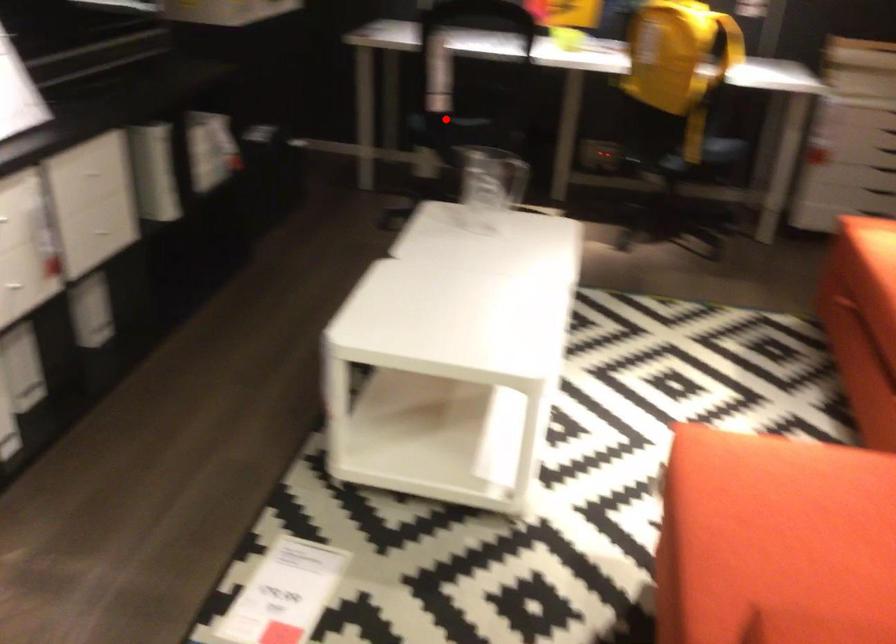
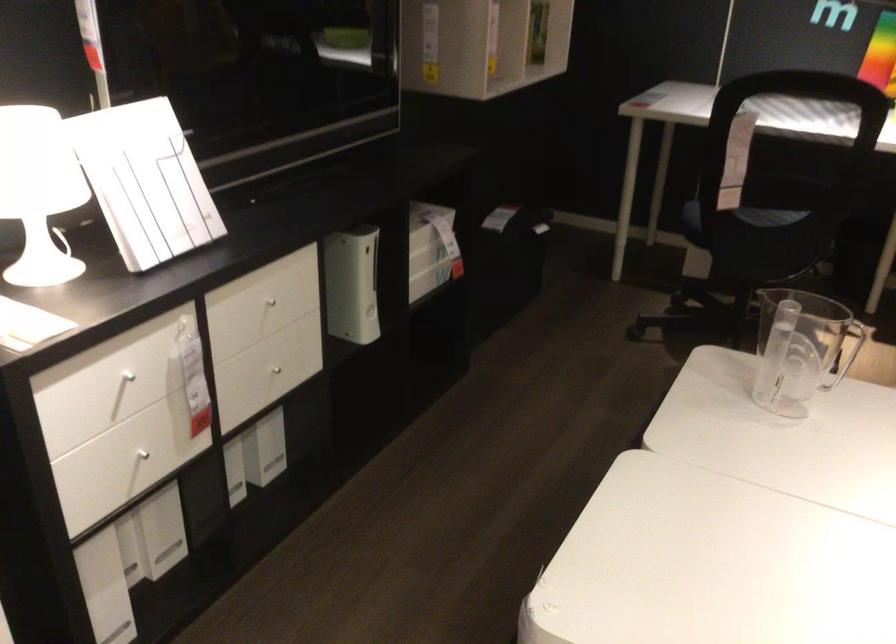
The point at the highlighted location is marked in the first image. Where is the corresponding point in the second image?

(739, 218)